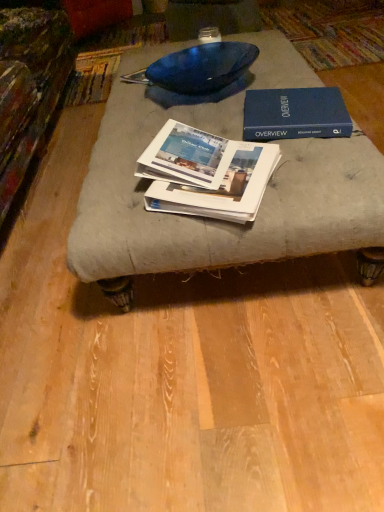
Question: In terms of size, does white paper booklet at center, positioned as the 2th book in bottom-to-top order, appear bigger or smaller than white glossy book at center, marked as the third book in a top-to-bottom arrangement?

Choices:
 (A) big
 (B) small

Answer: (B)

Question: Is white paper booklet at center, positioned as the 2th book in bottom-to-top order, taller or shorter than white glossy book at center, marked as the third book in a top-to-bottom arrangement?

Choices:
 (A) tall
 (B) short

Answer: (A)

Question: Estimate the real-world distances between objects in this image. Which object is farther from the white paper booklet at center, which is the second book in top-to-bottom order?

Choices:
 (A) blue hardcover book at upper right, which is counted as the first book, starting from the top
 (B) white glossy book at center, marked as the third book in a top-to-bottom arrangement

Answer: (A)

Question: Based on their relative distances, which object is nearer to the blue hardcover book at upper right, which is counted as the first book, starting from the top?

Choices:
 (A) white paper booklet at center, positioned as the 2th book in bottom-to-top order
 (B) white glossy book at center, the 1th book ordered from the bottom

Answer: (A)